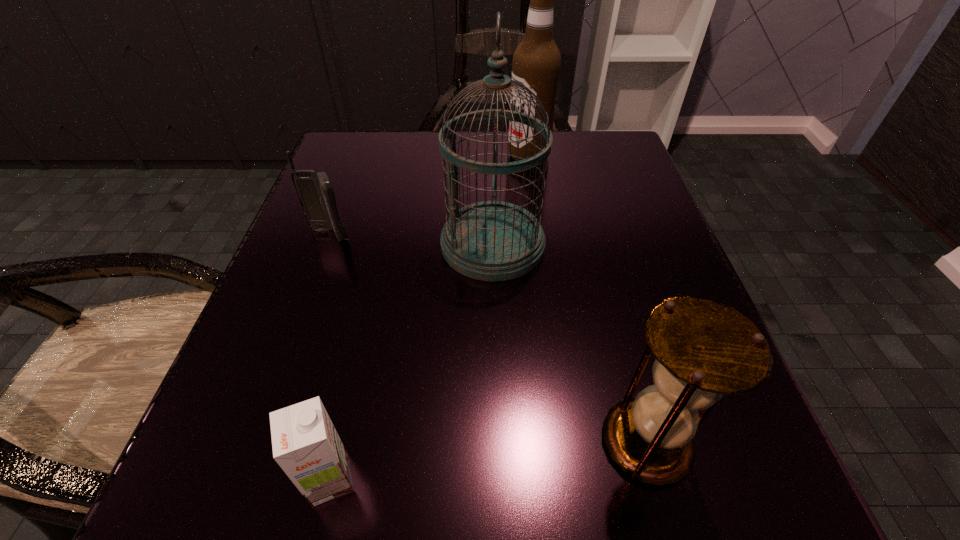
This screenshot has height=540, width=960. Identify the location of blank space that satisfies the following two spatial constraints: 1. on the front-facing side of the birdcage; 2. on the left side of the third shortest object. (498, 442).

Image resolution: width=960 pixels, height=540 pixels. I want to click on vacant space that satisfies the following two spatial constraints: 1. on the label of the alcohol; 2. on the front side of the second object from left to right, so click(575, 479).

Locate an element on the screen. The height and width of the screenshot is (540, 960). free location that satisfies the following two spatial constraints: 1. on the front-facing side of the birdcage; 2. on the right side of the third shortest object is located at coordinates (498, 442).

In order to click on free space that satisfies the following two spatial constraints: 1. on the keyboard of the leftmost object; 2. on the right side of the chocolate milk in this screenshot , I will do `click(241, 479)`.

Find the location of a particular element. The image size is (960, 540). vacant space that satisfies the following two spatial constraints: 1. on the keyboard of the hourglass; 2. on the left side of the cellular telephone is located at coordinates (254, 442).